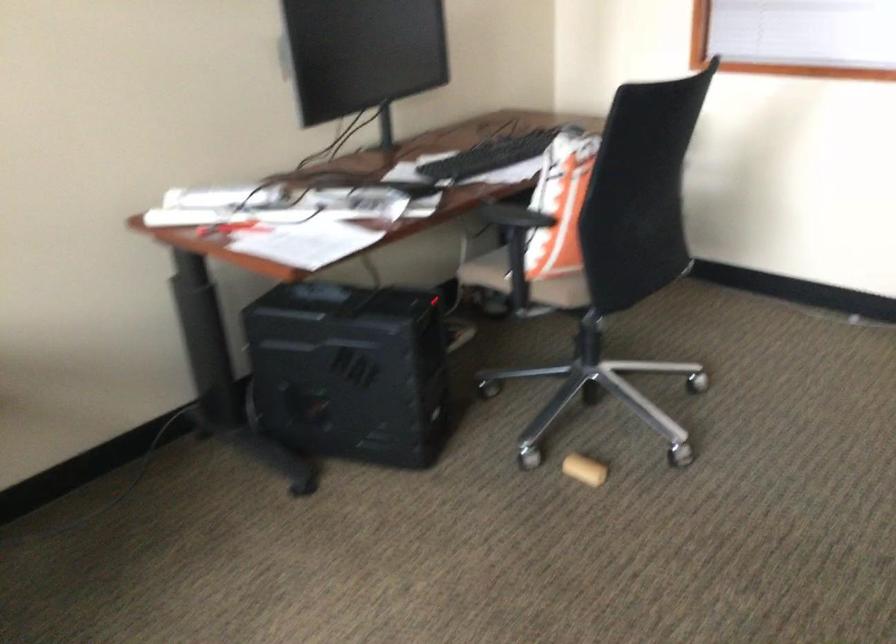
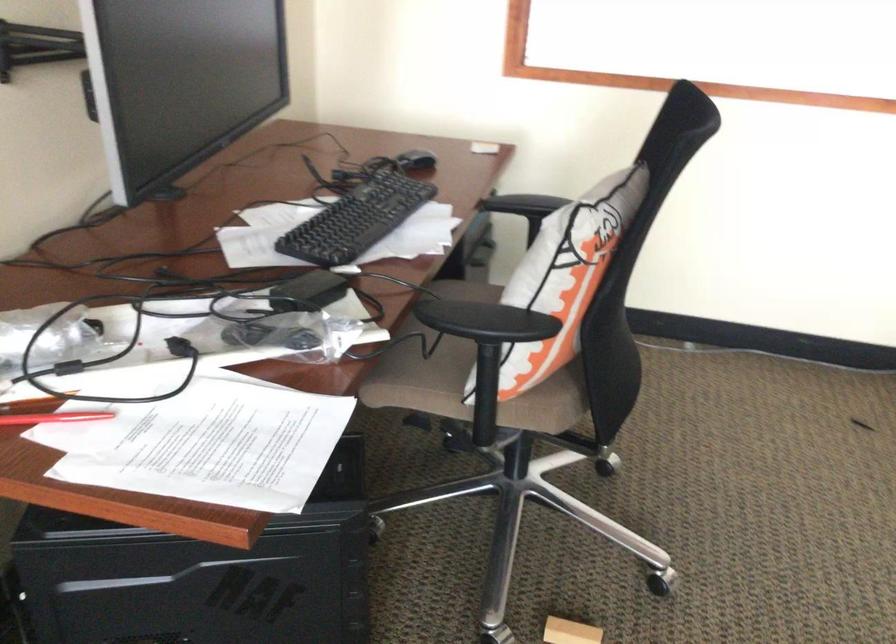
In the second image, find the point that corresponds to the point at 243,232 in the first image.

(54, 418)